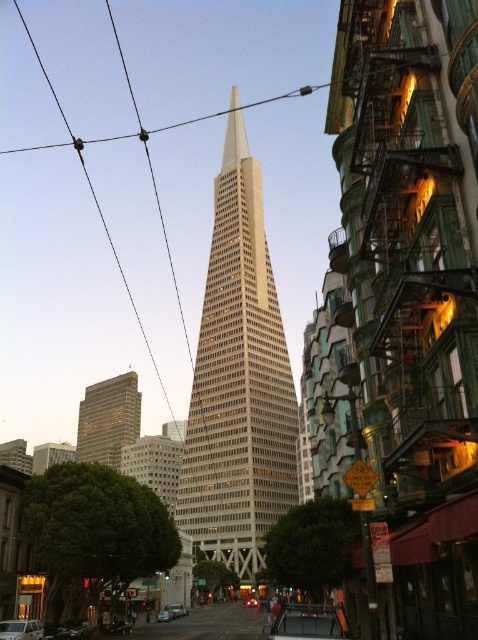
You are a city planner reviewing this urban scene. You notice the metallic wire at upper center and the white plastic car at lower left. Based on their positions, which object is located higher up in the image?

The metallic wire at upper center is positioned over the white plastic car at lower left, meaning it is higher up in the image.

You are standing at a viewpoint where the Transamerica Pyramid is clearly visible. You want to take a photo of the pyramid but need to ensure you are within the recommended 300 meters safety distance from a nearby construction site. The construction site is marked at point (36, 51). Are you within the safe distance?

The distance between your current position and the construction site at point (36, 51) is 271.13 meters, which is within the recommended 300 meters safety distance. However, it is advisable to maintain a safe distance from construction areas for your own safety.

You are standing at the center of the image and see a point labeled as point (75,628). Based on the scene description, can you determine what object this point is located on?

The point (75,628) is located on the shiny black car at lower left.